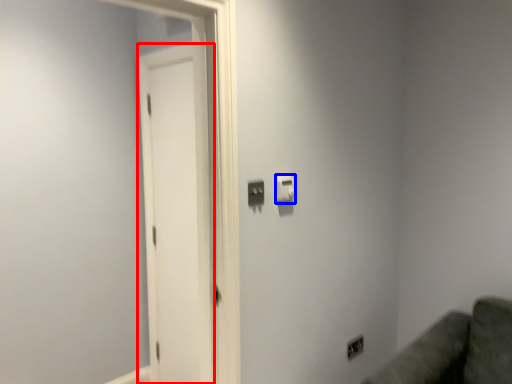
Question: Which object appears closest to the camera in this image, screen door (highlighted by a red box) or light switch (highlighted by a blue box)?

Choices:
 (A) screen door
 (B) light switch

Answer: (B)